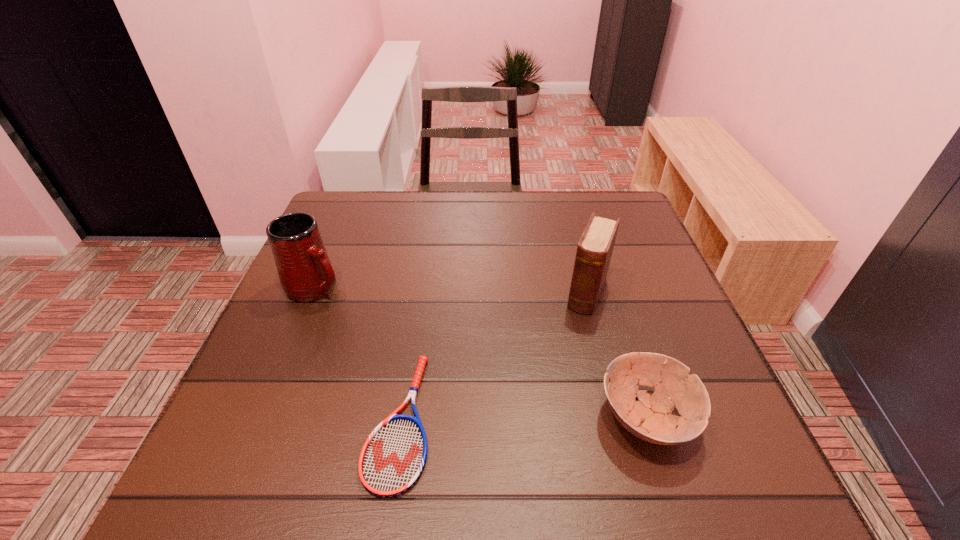
Identify the location of free space that satisfies the following two spatial constraints: 1. on the back side of the diary; 2. on the right side of the third object from right to left. This screenshot has height=540, width=960. (420, 293).